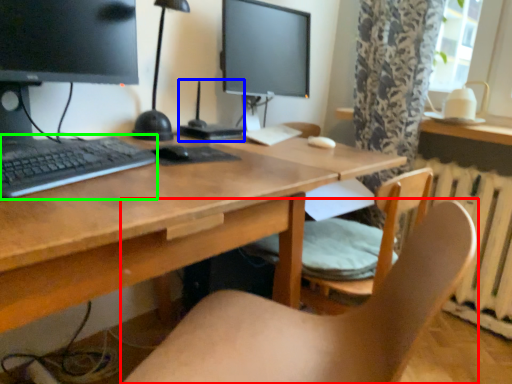
Question: Which object is positioned closest to chair (highlighted by a red box)? Select from computer (highlighted by a blue box) and computer keyboard (highlighted by a green box).

Choices:
 (A) computer
 (B) computer keyboard

Answer: (B)